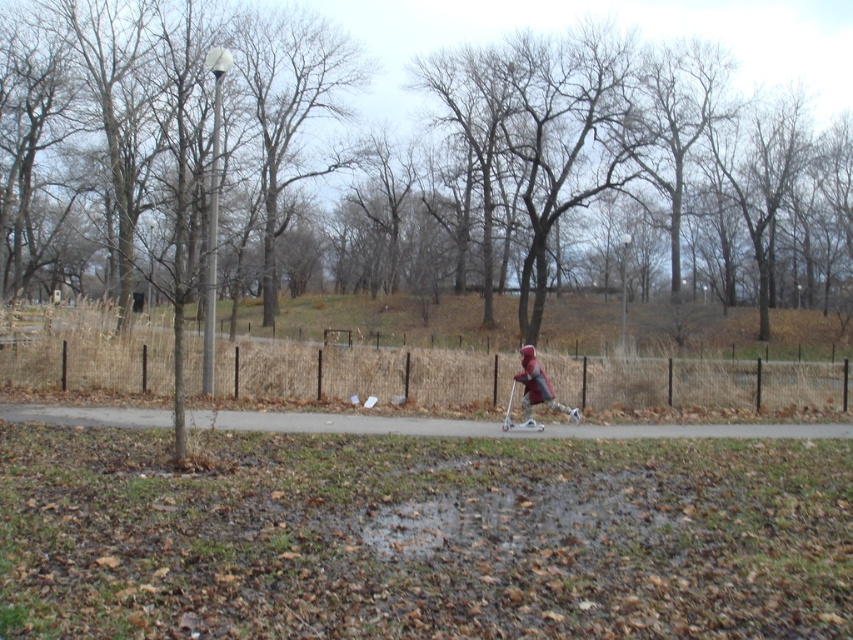
Is smooth asphalt path at center bigger than matte red jacket at center?

Yes, smooth asphalt path at center is bigger than matte red jacket at center.

Which of these two, smooth asphalt path at center or matte red jacket at center, stands taller?

matte red jacket at center

The height and width of the screenshot is (640, 853). What do you see at coordinates (338, 422) in the screenshot? I see `smooth asphalt path at center` at bounding box center [338, 422].

The height and width of the screenshot is (640, 853). I want to click on smooth asphalt path at center, so click(338, 422).

Does matte red scooter at center appear on the right side of smooth asphalt path at center?

Correct, you'll find matte red scooter at center to the right of smooth asphalt path at center.

Who is more forward, (663, 593) or (347, 413)?

Point (663, 593) is more forward.

Locate an element on the screen. matte red scooter at center is located at coordinates (421, 536).

Does matte red scooter at center have a larger size compared to matte red jacket at center?

Yes, matte red scooter at center is bigger than matte red jacket at center.

Does point (57, 461) come closer to viewer compared to point (544, 388)?

Yes.

At what (x,y) coordinates should I click in order to perform the action: click on matte red scooter at center. Please return your answer as a coordinate pair (x, y). Looking at the image, I should click on (421, 536).